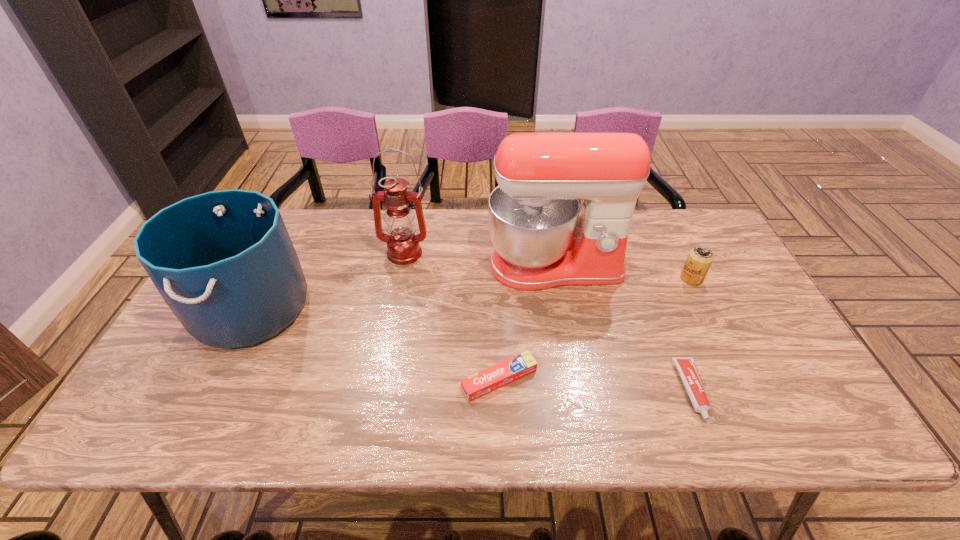
Find the location of `mixer`. mixer is located at coordinates (543, 237).

Find the location of a particular element. This screenshot has height=540, width=960. the fifth object from right to left is located at coordinates (403, 246).

Identify the location of the leftmost object. The height and width of the screenshot is (540, 960). 223,261.

Identify the location of the fourth shortest object. The width and height of the screenshot is (960, 540). (223, 261).

Find the location of a particular element. This screenshot has height=540, width=960. the rightmost object is located at coordinates (699, 260).

Identify the location of the third shortest object. Image resolution: width=960 pixels, height=540 pixels. (699, 260).

At what (x,y) coordinates should I click in order to perform the action: click on the left toothpaste. Please return your answer as a coordinate pair (x, y). The width and height of the screenshot is (960, 540). Looking at the image, I should click on click(486, 381).

The height and width of the screenshot is (540, 960). Find the location of `the fifth object from left to right`. the fifth object from left to right is located at coordinates click(x=686, y=367).

Locate an element on the screen. Image resolution: width=960 pixels, height=540 pixels. free space located 0.180m on the front-facing side of the mixer is located at coordinates (569, 346).

The width and height of the screenshot is (960, 540). Find the location of `vacant area situated 0.160m on the front of the fifth object from right to left`. vacant area situated 0.160m on the front of the fifth object from right to left is located at coordinates (394, 304).